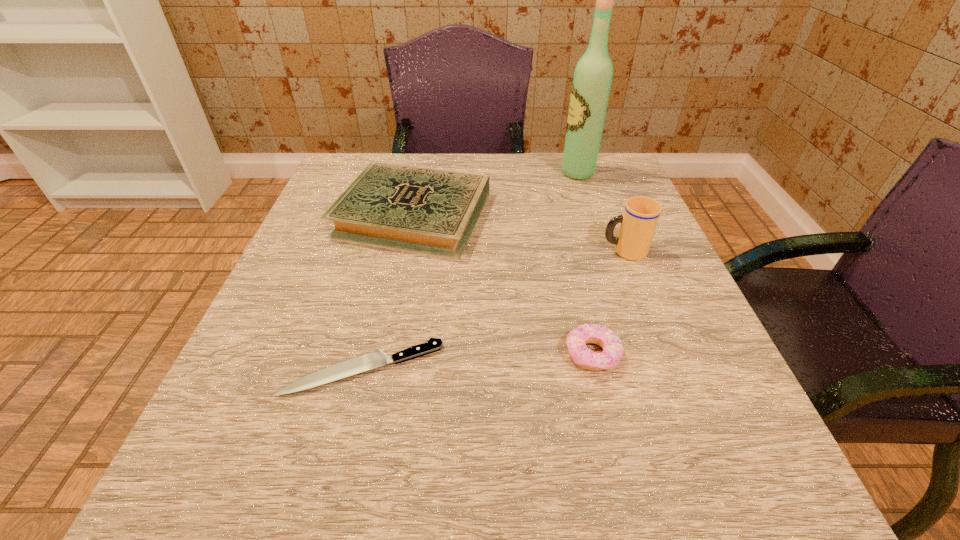
This screenshot has height=540, width=960. I want to click on vacant space located 0.170m on the side of the cup with the handle, so click(515, 251).

Locate an element on the screen. The height and width of the screenshot is (540, 960). free region located 0.100m on the front of the hardback book is located at coordinates (396, 297).

You are a GUI agent. You are given a task and a screenshot of the screen. Output one action in this format:
    pyautogui.click(x=<x>, y=<y>)
    Task: Click on the vacant space positioned 0.070m on the left of the doughnut
    
    Given the screenshot: What is the action you would take?
    pyautogui.click(x=519, y=354)

In order to click on vacant space located on the left of the steak knife in this screenshot , I will do `click(251, 368)`.

Locate an element on the screen. The image size is (960, 540). wine bottle that is at the far edge is located at coordinates (591, 85).

Identify the location of hardback book that is at the far edge. This screenshot has height=540, width=960. (430, 211).

You are a GUI agent. You are given a task and a screenshot of the screen. Output one action in this format:
    pyautogui.click(x=<x>, y=<y>)
    Task: Click on the hardback book located in the left edge section of the desktop
    The width and height of the screenshot is (960, 540).
    Given the screenshot: What is the action you would take?
    pyautogui.click(x=430, y=211)

Locate an element on the screen. The height and width of the screenshot is (540, 960). steak knife that is positioned at the left edge is located at coordinates (375, 359).

Locate an element on the screen. The image size is (960, 540). wine bottle that is positioned at the right edge is located at coordinates (591, 85).

You are a GUI agent. You are given a task and a screenshot of the screen. Output one action in this format:
    pyautogui.click(x=<x>, y=<y>)
    Task: Click on the cup that is at the right edge
    This screenshot has height=540, width=960.
    Given the screenshot: What is the action you would take?
    pyautogui.click(x=639, y=220)